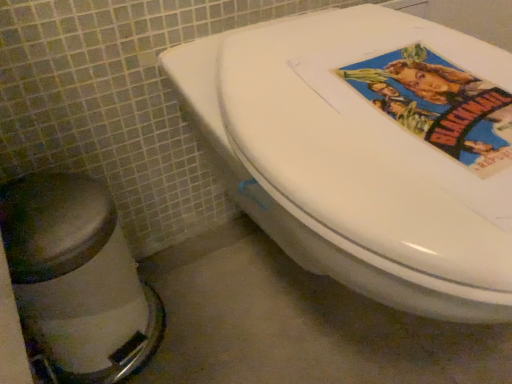
Where is `free space above white glossy toilet at center (from a real-world perspective)`? This screenshot has width=512, height=384. free space above white glossy toilet at center (from a real-world perspective) is located at coordinates (360, 61).